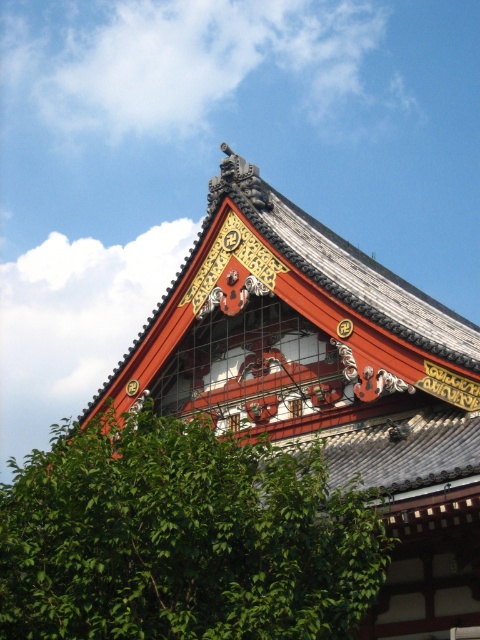
Who is positioned more to the left, green leafy tree at lower left or shiny red wood roof at upper center?

Positioned to the left is green leafy tree at lower left.

Is point (119, 586) positioned in front of point (154, 358)?

Yes, it is in front of point (154, 358).

Image resolution: width=480 pixels, height=640 pixels. I want to click on green leafy tree at lower left, so click(181, 538).